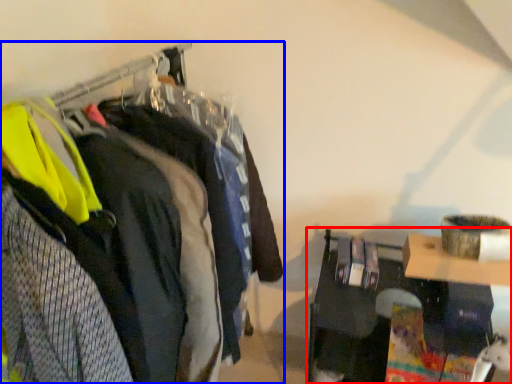
Question: Which point is closer to the camera, furniture (highlighted by a red box) or closet (highlighted by a blue box)?

Choices:
 (A) furniture
 (B) closet

Answer: (B)